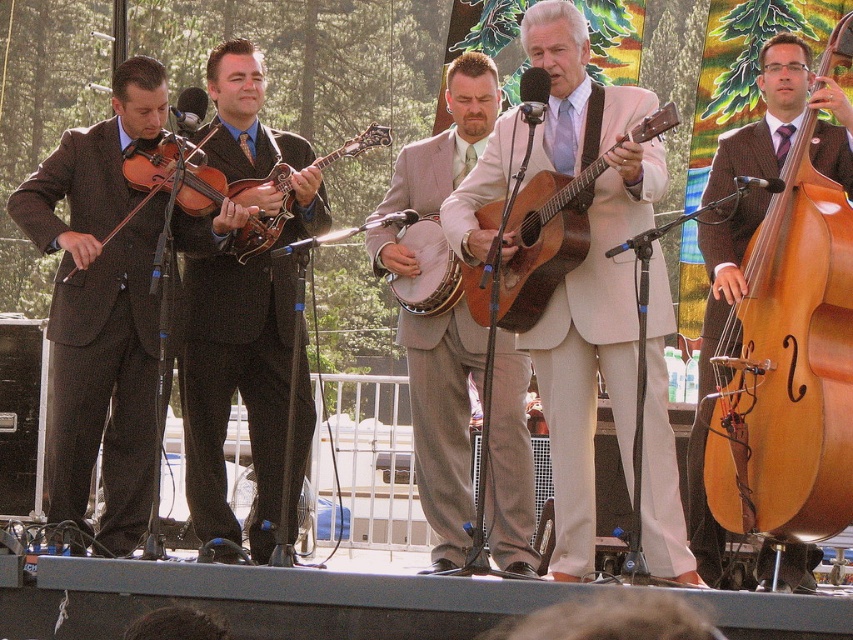
From the picture: You are a stagehand who needs to place a protective cover over the light brown polished wood cello at right and the shiny brown mandolin at center. Which instrument requires a larger cover?

The light brown polished wood cello at right requires a larger cover since it is bigger than the shiny brown mandolin at center.

You are a photographer standing at the back of the audience, trying to capture a clear photo of the light beige suit at center and the light brown polished wood cello at right. Based on their heights, which one is more likely to block the view of the other?

The light beige suit at center has a greater height compared to the light brown polished wood cello at right, so the light beige suit at center is more likely to block the view of the light brown polished wood cello at right.

You are a photographer trying to capture a group photo of the band members. You notice the light beige suit at center and the light brown polished wood cello at right. Which object should you position closer to the camera to ensure both fit within the frame without cropping?

The light beige suit at center has a larger width than the light brown polished wood cello at right. To ensure both fit within the frame, position the light brown polished wood cello at right closer to the camera since it is narrower and requires less space.